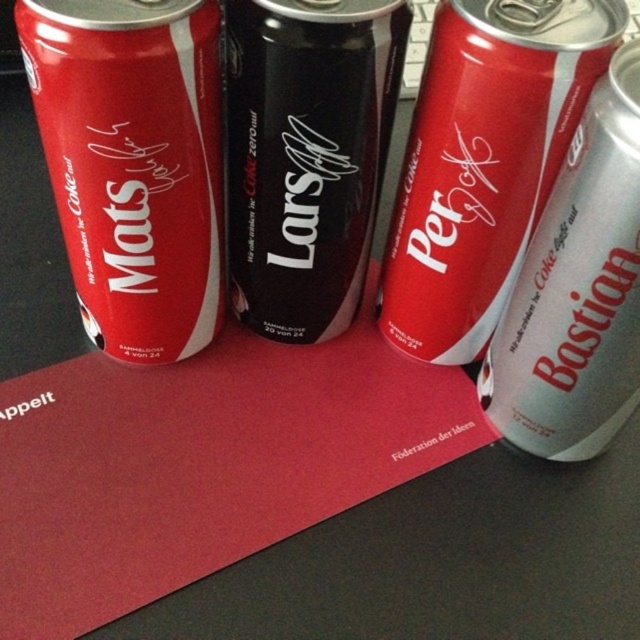
You are trying to stack the matte black can at left and the black matte can at center. Which can should you place at the bottom to ensure stability?

The matte black can at left is taller than the black matte can at center, so placing the taller matte black can at left at the bottom would provide a more stable base for the stack.

You are standing 5 feet away from the camera. Can you reach the matte black can at left without moving your feet?

The matte black can at left is 31.86 inches from the camera. Since you are standing 5 feet away, which is 60 inches, the can is farther away than your reach. You cannot reach it without moving your feet.

You are trying to stack the matte black can at left and the matte silver can at center. Which one should you place at the bottom to ensure stability?

The matte silver can at center is larger than the matte black can at left, so placing the larger matte silver can at center at the bottom would provide better stability for the stack.